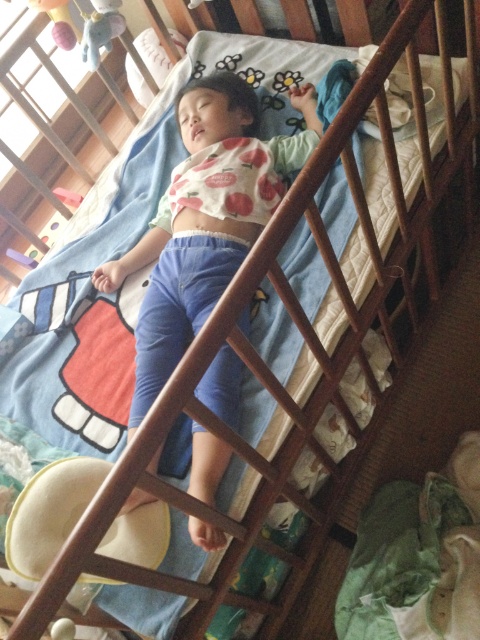
Who is more forward, (233, 264) or (93, 67)?

Point (233, 264) is in front.

Does point (229, 385) lie behind point (82, 54)?

No.

Find the location of `matte white shirt at center`. matte white shirt at center is located at coordinates click(x=204, y=220).